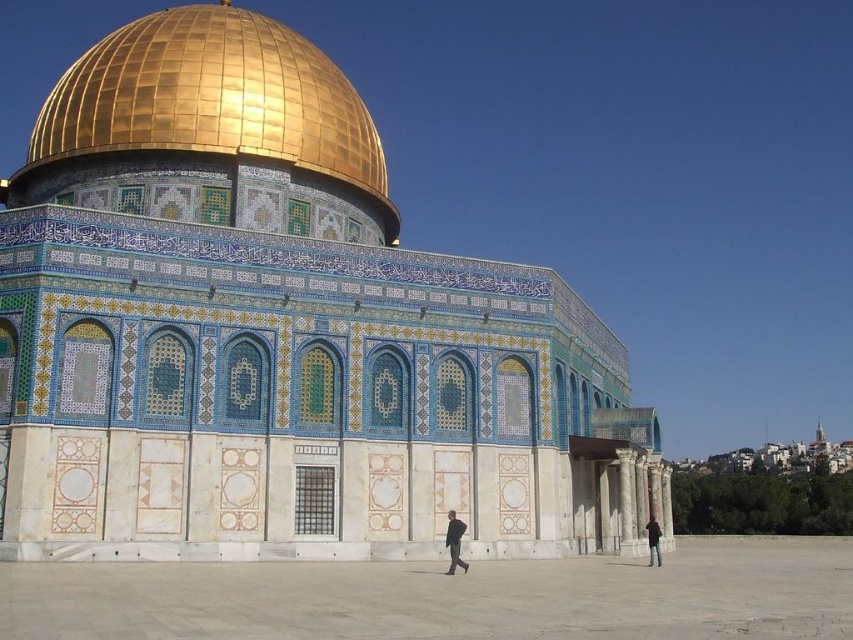
You are an architect analyzing the Dome of the Rock. You notice the gold polished dome at upper center and the black fabric at center. Which object is located to the right of the other?

The gold polished dome at upper center is positioned on the left side of black fabric at center, so the black fabric at center is to the right of the gold polished dome at upper center.

You are an architect examining the Dome of the Rock. You notice two domes in the image. Which dome is located higher up? The shiny gold dome at upper center or the gold polished dome at upper center?

The shiny gold dome at upper center is positioned under the gold polished dome at upper center, so the gold polished dome at upper center is higher up.